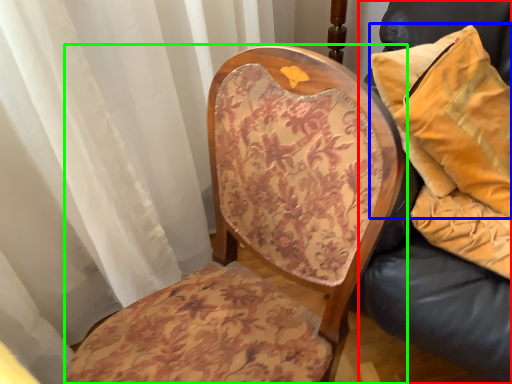
Question: Which object is positioned closest to furniture (highlighted by a red box)? Select from pillow (highlighted by a blue box) and chair (highlighted by a green box).

Choices:
 (A) pillow
 (B) chair

Answer: (A)